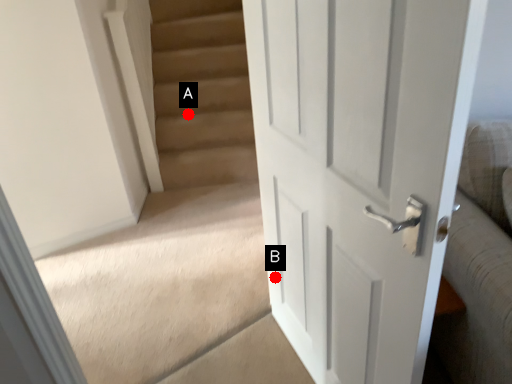
Question: Two points are circled on the image, labeled by A and B beside each circle. Which point appears closest to the camera in this image?

Choices:
 (A) A is closer
 (B) B is closer

Answer: (B)